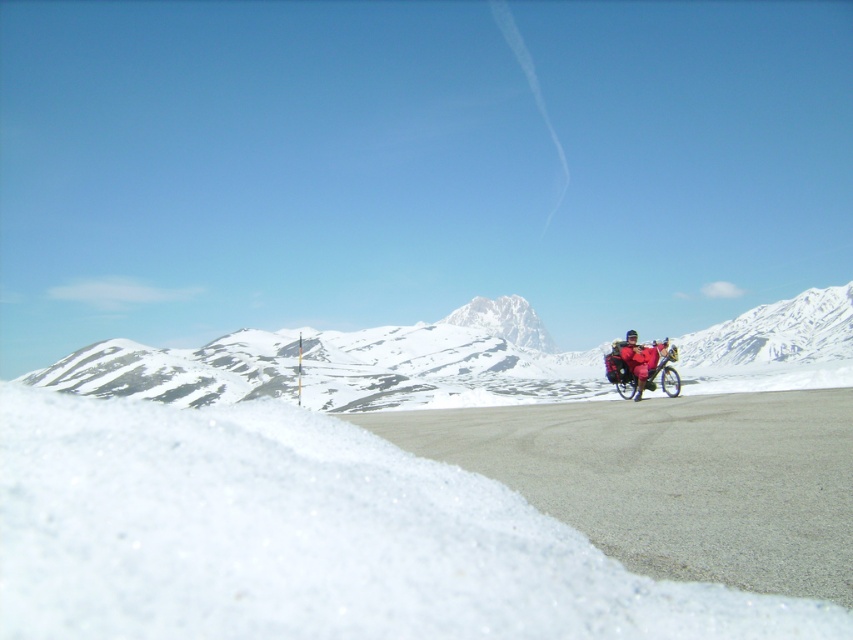
Question: Which object is the farthest from the white snow-covered mountain at upper center?

Choices:
 (A) white powdery snow at lower left
 (B) snowy white mountain at right
 (C) white snow-covered mountain at center

Answer: (A)

Question: Is white powdery snow at lower left positioned behind red fabric jacket at right?

Choices:
 (A) yes
 (B) no

Answer: (B)

Question: Which of the following is the farthest from the observer?

Choices:
 (A) (814, 342)
 (B) (688, 362)
 (C) (492, 317)

Answer: (C)

Question: Estimate the real-world distances between objects in this image. Which object is farther from the white powdery snow at lower left?

Choices:
 (A) snowy white mountain at right
 (B) red fabric jacket at right
 (C) shiny blue bicycle at right
 (D) white snow-covered mountain at center

Answer: (D)

Question: Does snowy white mountain at right have a smaller size compared to red fabric jacket at right?

Choices:
 (A) yes
 (B) no

Answer: (B)

Question: Is snowy white mountain at right further to the viewer compared to white snow-covered mountain at center?

Choices:
 (A) yes
 (B) no

Answer: (B)